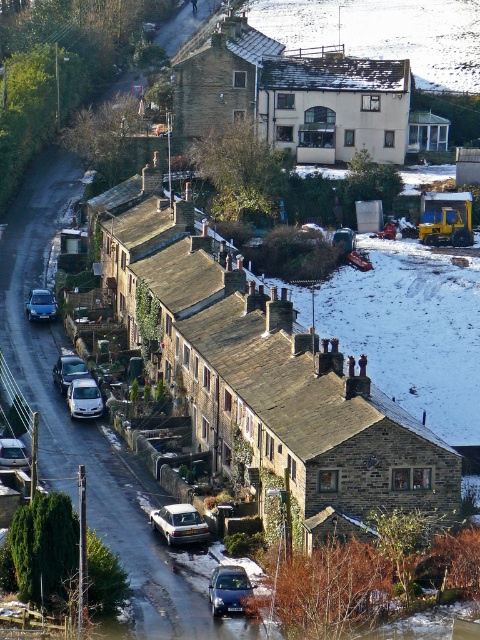
Can you confirm if matte blue car at left is smaller than silver metallic car at lower left?

Indeed, matte blue car at left has a smaller size compared to silver metallic car at lower left.

Which of these two, matte blue car at left or silver metallic car at lower left, stands shorter?

With less height is silver metallic car at lower left.

Who is more distant from viewer, (41, 300) or (20, 465)?

The point (41, 300) is more distant.

The width and height of the screenshot is (480, 640). I want to click on matte blue car at left, so click(x=40, y=305).

Which is behind, point (81, 368) or point (1, 445)?

The point (81, 368) is behind.

Can you confirm if white matte car at lower left is smaller than silver metallic car at lower left?

Yes, white matte car at lower left is smaller than silver metallic car at lower left.

Find the location of a particular element. The width and height of the screenshot is (480, 640). white matte car at lower left is located at coordinates (69, 371).

Between white matte car at lower center and dark gray metallic car at center, which one is positioned lower?

dark gray metallic car at center is below.

Does point (183, 525) lie behind point (216, 586)?

That is True.

You are a GUI agent. You are given a task and a screenshot of the screen. Output one action in this format:
    pyautogui.click(x=<x>, y=<y>)
    Task: Click on the white matte car at lower center
    
    Given the screenshot: What is the action you would take?
    pyautogui.click(x=180, y=524)